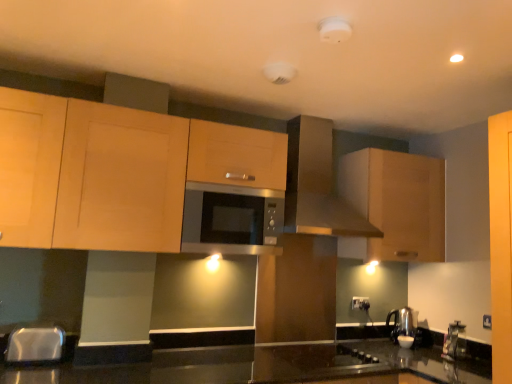
Question: Does white glossy kettle at lower right lie behind white plastic electric outlet at center?

Choices:
 (A) yes
 (B) no

Answer: (B)

Question: From the image's perspective, does white glossy kettle at lower right appear lower than white plastic electric outlet at center?

Choices:
 (A) no
 (B) yes

Answer: (B)

Question: Does white glossy kettle at lower right appear on the right side of white plastic electric outlet at center?

Choices:
 (A) no
 (B) yes

Answer: (B)

Question: From a real-world perspective, does white glossy kettle at lower right sit lower than white plastic electric outlet at center?

Choices:
 (A) yes
 (B) no

Answer: (A)

Question: Considering the relative sizes of white glossy kettle at lower right and white plastic electric outlet at center in the image provided, is white glossy kettle at lower right shorter than white plastic electric outlet at center?

Choices:
 (A) yes
 (B) no

Answer: (A)

Question: Is white glossy kettle at lower right looking in the opposite direction of white plastic electric outlet at center?

Choices:
 (A) yes
 (B) no

Answer: (B)

Question: Considering the relative positions of matte brown range hood at upper center and satin silver microwave at center in the image provided, is matte brown range hood at upper center to the right of satin silver microwave at center from the viewer's perspective?

Choices:
 (A) no
 (B) yes

Answer: (B)

Question: Is matte brown range hood at upper center further to the viewer compared to satin silver microwave at center?

Choices:
 (A) yes
 (B) no

Answer: (A)

Question: From the image's perspective, does matte brown range hood at upper center appear lower than satin silver microwave at center?

Choices:
 (A) no
 (B) yes

Answer: (A)

Question: Considering the relative sizes of matte brown range hood at upper center and satin silver microwave at center in the image provided, is matte brown range hood at upper center thinner than satin silver microwave at center?

Choices:
 (A) no
 (B) yes

Answer: (A)

Question: From a real-world perspective, does matte brown range hood at upper center stand above satin silver microwave at center?

Choices:
 (A) no
 (B) yes

Answer: (B)

Question: Is matte brown range hood at upper center positioned with its back to satin silver microwave at center?

Choices:
 (A) yes
 (B) no

Answer: (B)

Question: From the image's perspective, is light wood cabinet at upper center, which is the first cabinetry from left to right, located beneath matte wood cabinet at upper right, placed as the second cabinetry when sorted from left to right?

Choices:
 (A) no
 (B) yes

Answer: (A)